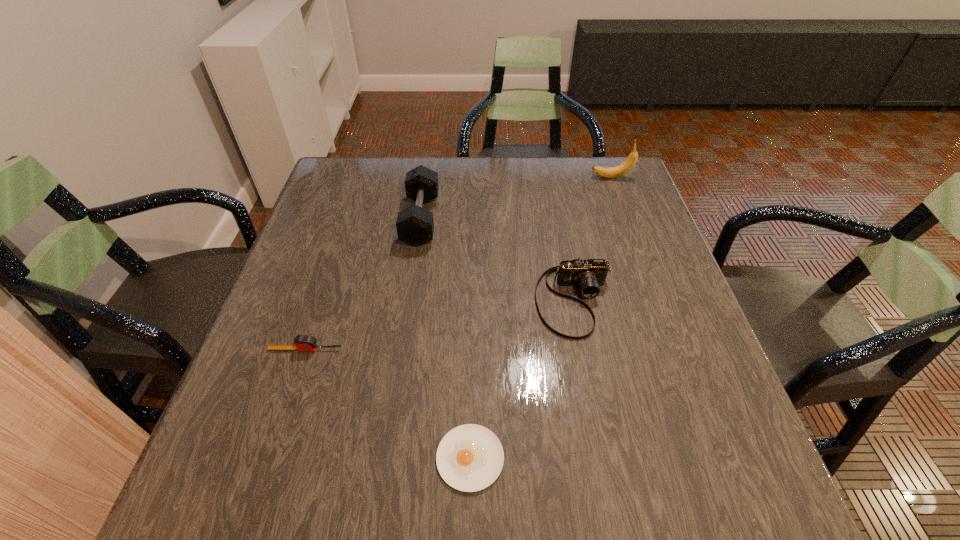
Identify the location of free spot between the nearest object and the fourth object from right to left. (445, 339).

The height and width of the screenshot is (540, 960). Identify the location of vacant space that's between the farthest object and the second object from left to right. (516, 198).

Locate an element on the screen. empty space that is in between the tape measure and the nearest object is located at coordinates 388,404.

Identify the location of free spot between the fourth object from left to right and the fourth object from right to left. The width and height of the screenshot is (960, 540). (497, 260).

Identify the location of vacant area that lies between the fourth object from right to left and the rightmost object. This screenshot has width=960, height=540. (516, 198).

In order to click on free space between the farthest object and the third tallest object in this screenshot , I will do `click(593, 239)`.

Identify the location of vacant space that is in between the third object from right to left and the fourth farthest object. This screenshot has width=960, height=540. (388, 404).

Image resolution: width=960 pixels, height=540 pixels. I want to click on vacant region between the tallest object and the leftmost object, so click(459, 264).

In order to click on blank region between the fourth nearest object and the farthest object in this screenshot , I will do `click(516, 198)`.

Where is `vacant space that's between the second shortest object and the rightmost object`? This screenshot has width=960, height=540. vacant space that's between the second shortest object and the rightmost object is located at coordinates (459, 264).